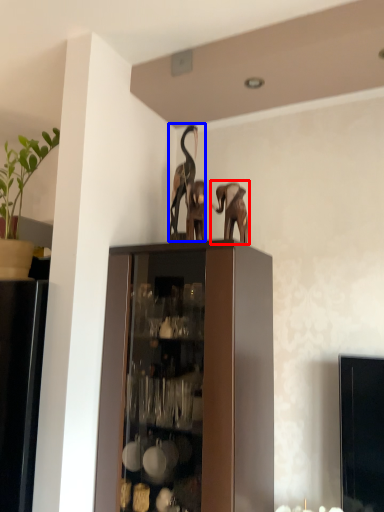
Question: Among these objects, which one is farthest to the camera, elephant (highlighted by a red box) or animal (highlighted by a blue box)?

Choices:
 (A) elephant
 (B) animal

Answer: (B)